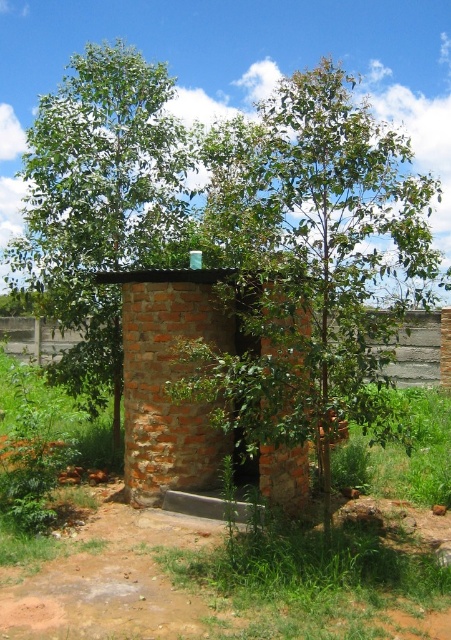
Question: Does green leafy tree at center lie behind gray concrete fence at lower center?

Choices:
 (A) yes
 (B) no

Answer: (B)

Question: Is brick hut at center thinner than gray concrete fence at lower center?

Choices:
 (A) yes
 (B) no

Answer: (A)

Question: Among these objects, which one is nearest to the camera?

Choices:
 (A) green leafy tree at left
 (B) green leafy tree at center
 (C) gray concrete fence at lower center
 (D) brick hut at center

Answer: (B)

Question: Is green leafy tree at left to the right of brick hut at center from the viewer's perspective?

Choices:
 (A) yes
 (B) no

Answer: (B)

Question: Which object is the closest to the gray concrete fence at lower center?

Choices:
 (A) brick hut at center
 (B) green leafy tree at left

Answer: (B)

Question: Estimate the real-world distances between objects in this image. Which object is farther from the gray concrete fence at lower center?

Choices:
 (A) brick hut at center
 (B) green leafy tree at center
 (C) green leafy tree at left

Answer: (B)